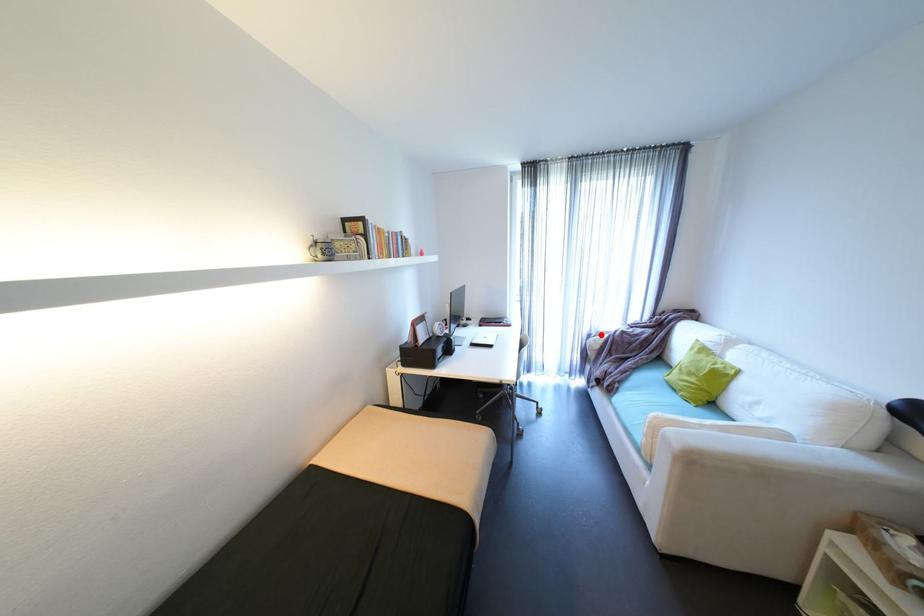
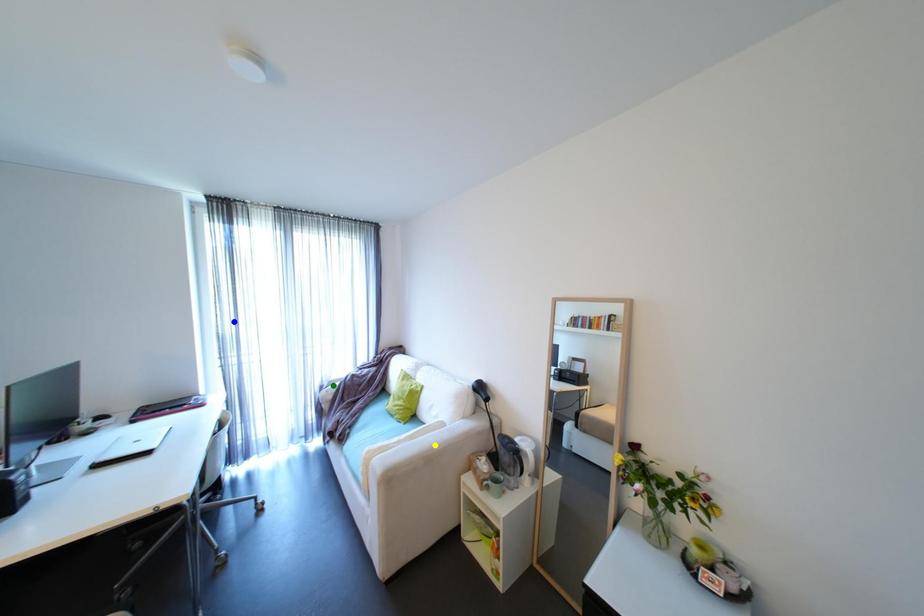
Question: I am providing you with two images of the same scene from different viewpoints. A red point is marked on the first image. You are given multiple points on the second image. Which spot in image 2 lines up with the point in image 1?

Choices:
 (A) blue point
 (B) green point
 (C) yellow point

Answer: (B)